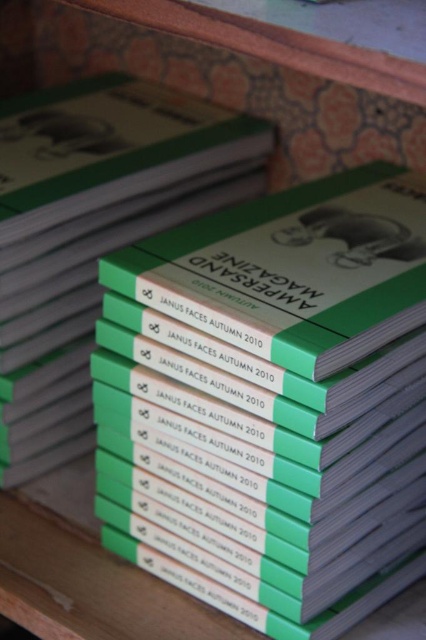
Does green matte paper at center have a lesser height compared to green matte magazine at center?

In fact, green matte paper at center may be taller than green matte magazine at center.

Does green matte paper at center have a larger size compared to green matte magazine at center?

Correct, green matte paper at center is larger in size than green matte magazine at center.

Does point (0, 205) lie behind point (322, 250)?

Yes, it is.

Find the location of a particular element. This screenshot has height=640, width=426. green matte paper at center is located at coordinates (94, 234).